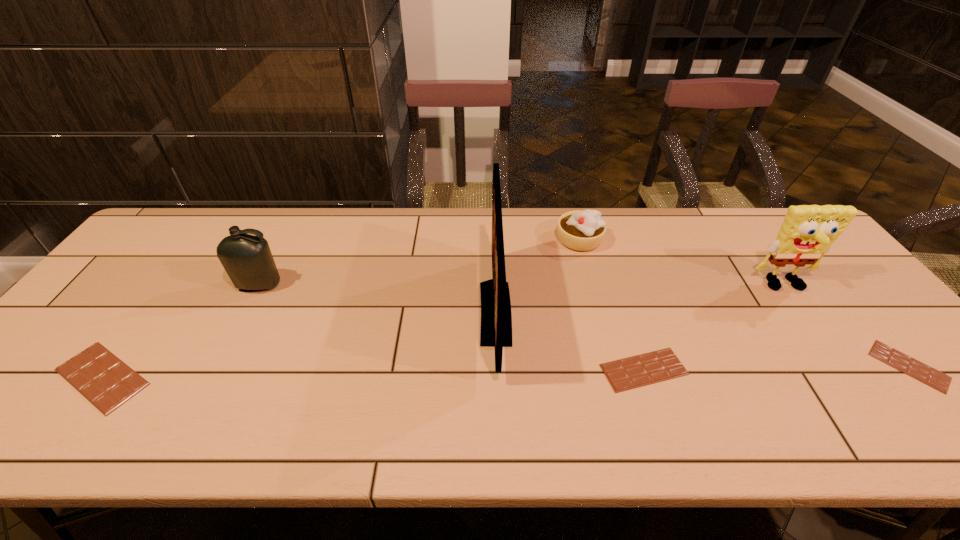
You are a GUI agent. You are given a task and a screenshot of the screen. Output one action in this format:
    pyautogui.click(x=<x>, y=<y>)
    Task: Click on the tallest chocolate bar
    
    Given the screenshot: What is the action you would take?
    pyautogui.click(x=102, y=378)

The height and width of the screenshot is (540, 960). Identify the location of the leftmost chocolate bar. (102, 378).

The width and height of the screenshot is (960, 540). What are the coordinates of `the second tallest chocolate bar` in the screenshot? It's located at (636, 371).

You are a GUI agent. You are given a task and a screenshot of the screen. Output one action in this format:
    pyautogui.click(x=<x>, y=<y>)
    Task: Click on the second shortest object
    The image size is (960, 540).
    Given the screenshot: What is the action you would take?
    pyautogui.click(x=636, y=371)

Locate an element on the screen. Image resolution: width=960 pixels, height=540 pixels. whipped cream is located at coordinates (581, 230).

Locate an element on the screen. This screenshot has height=540, width=960. the farthest object is located at coordinates (581, 230).

You are a GUI agent. You are given a task and a screenshot of the screen. Output one action in this format:
    pyautogui.click(x=<x>, y=<y>)
    Task: Click on the third tallest object
    This screenshot has height=540, width=960.
    Given the screenshot: What is the action you would take?
    pyautogui.click(x=247, y=259)

Where is `the second object from left to right`? The height and width of the screenshot is (540, 960). the second object from left to right is located at coordinates (247, 259).

The image size is (960, 540). I want to click on sponge, so click(x=808, y=231).

The image size is (960, 540). Identify the location of the tallest object. (496, 318).